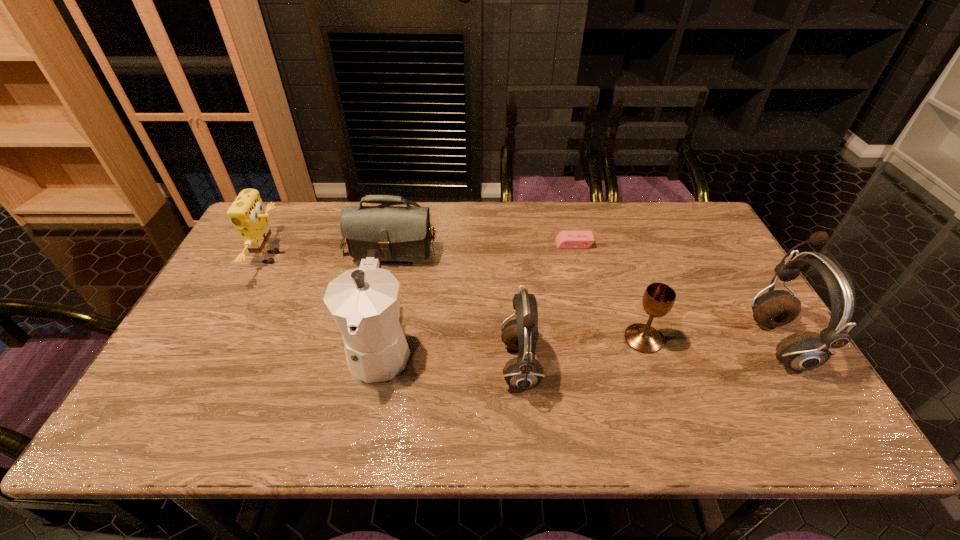
Point out which object is positioned as the sixth nearest to the shoulder bag. Please provide its 2D coordinates. Your answer should be formatted as a tuple, i.e. [(x, y)], where the tuple contains the x and y coordinates of a point satisfying the conditions above.

[(807, 350)]

The width and height of the screenshot is (960, 540). In order to click on the sixth closest object to the coffeepot in this screenshot , I will do `click(807, 350)`.

Image resolution: width=960 pixels, height=540 pixels. Find the location of `vacant space that satisfies the following two spatial constraints: 1. on the face of the sponge; 2. on the left side of the sixth object from left to right`. vacant space that satisfies the following two spatial constraints: 1. on the face of the sponge; 2. on the left side of the sixth object from left to right is located at coordinates (231, 339).

At what (x,y) coordinates should I click in order to perform the action: click on free location that satisfies the following two spatial constraints: 1. on the front side of the second shortest object; 2. on the right side of the shortest object. Please return your answer as a coordinate pair (x, y). The width and height of the screenshot is (960, 540). Looking at the image, I should click on (596, 339).